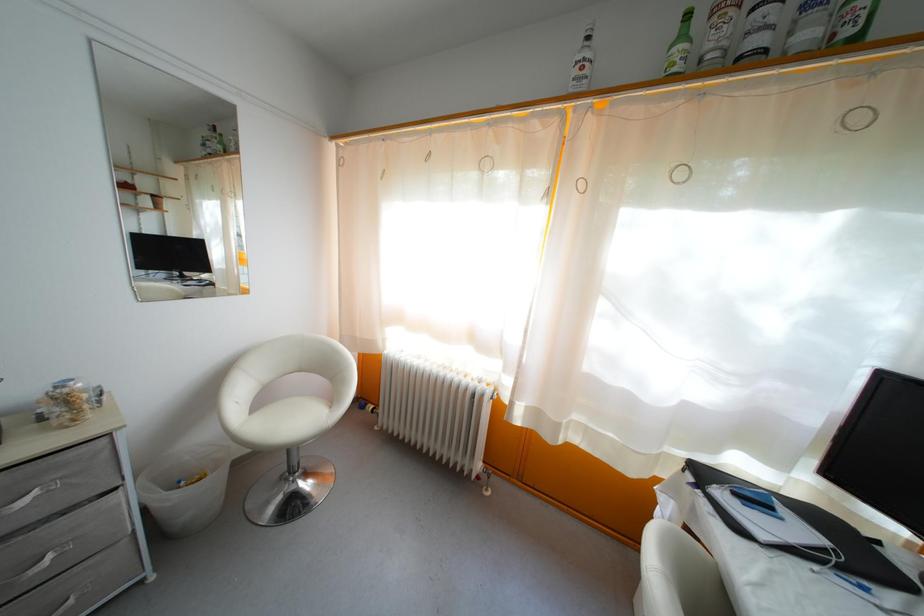
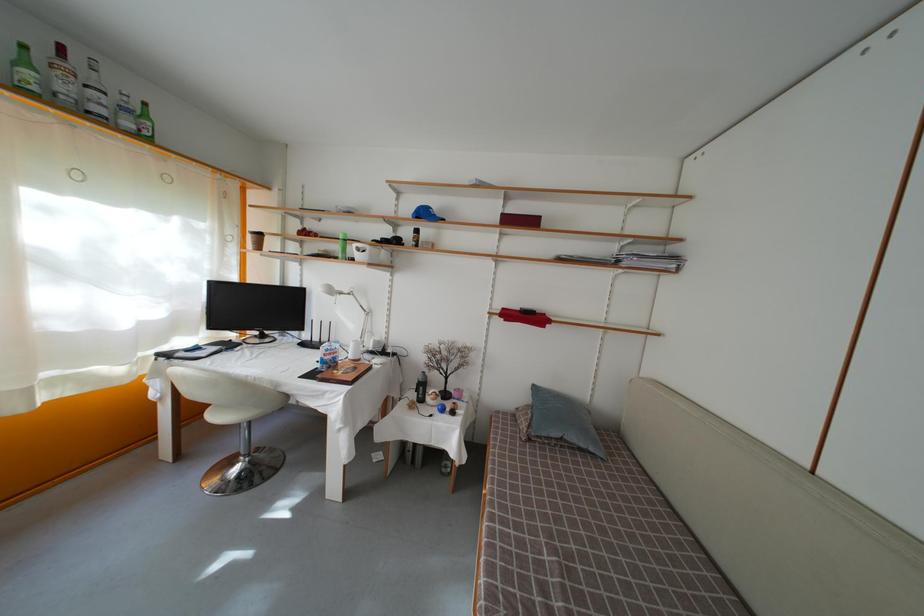
Where in the second image is the point corresponding to the point at 688,43 from the first image?

(31, 69)